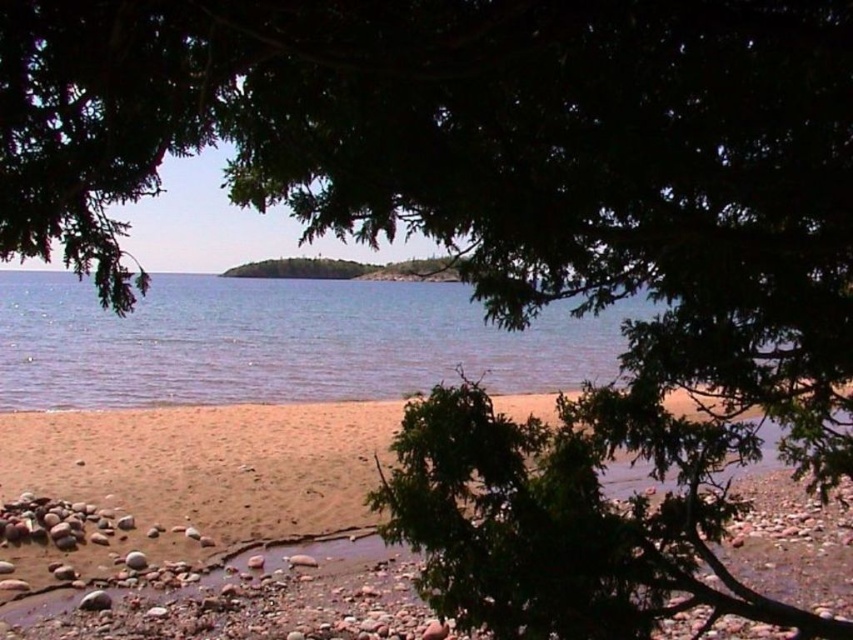
Between point (431, 579) and point (157, 300), which one is positioned in front?

Positioned in front is point (431, 579).

Is brown sand at lower center thinner than clear blue water at center?

Yes, brown sand at lower center is thinner than clear blue water at center.

Who is more forward, (457, 451) or (103, 388)?

Positioned in front is point (457, 451).

Identify the location of brown sand at lower center. (550, 532).